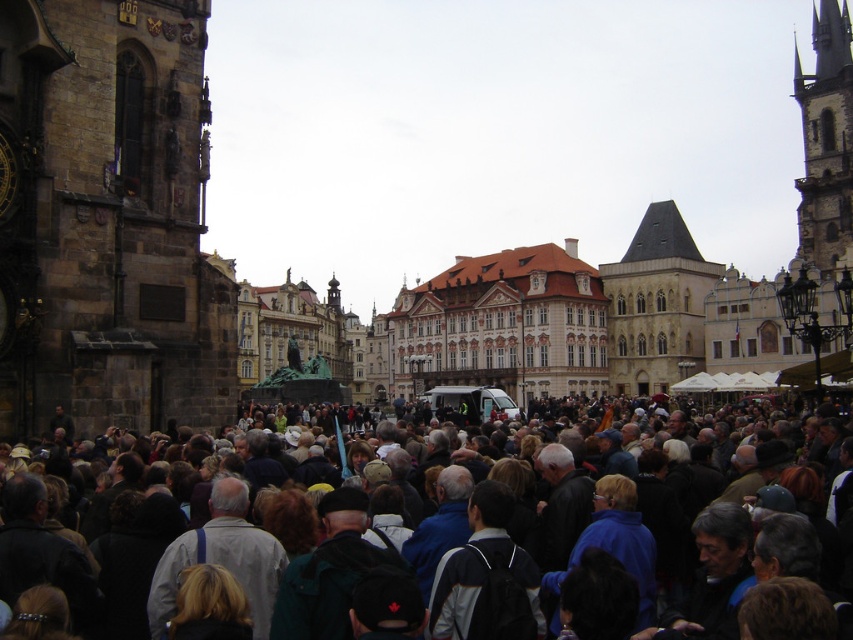
Question: Does stone clock tower at left appear under dark gray clothing at center?

Choices:
 (A) yes
 (B) no

Answer: (B)

Question: Is stone clock tower at left below brown stone building at center?

Choices:
 (A) yes
 (B) no

Answer: (B)

Question: Which object is the closest to the dark gray clothing at center?

Choices:
 (A) stone steeple at right
 (B) brown stone building at center
 (C) stone clock tower at left

Answer: (C)

Question: Is brown stone building at center thinner than stone steeple at right?

Choices:
 (A) yes
 (B) no

Answer: (B)

Question: Which of the following is the farthest from the observer?

Choices:
 (A) (167, 392)
 (B) (757, 468)
 (C) (819, 112)
 (D) (589, 266)

Answer: (C)

Question: Which object is the farthest from the stone clock tower at left?

Choices:
 (A) brown stone building at center
 (B) dark gray clothing at center
 (C) stone steeple at right

Answer: (C)